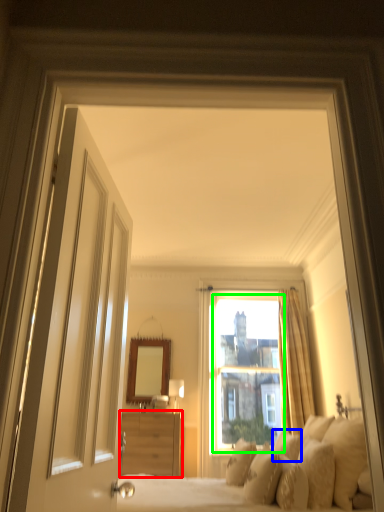
Question: Estimate the real-world distances between objects in this image. Which object is farther from cabinetry (highlighted by a red box), pillow (highlighted by a blue box) or window screen (highlighted by a green box)?

Choices:
 (A) pillow
 (B) window screen

Answer: (B)